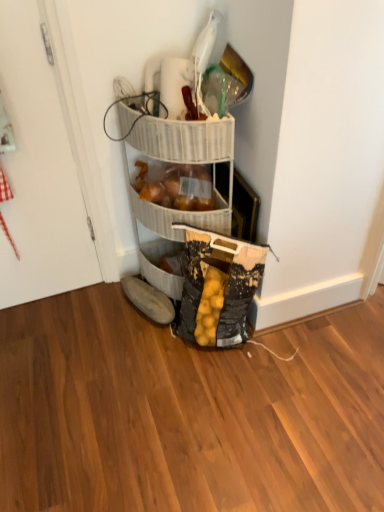
Image resolution: width=384 pixels, height=512 pixels. What are the coordinates of `translucent plastic bag of onions at center` in the screenshot? It's located at (179, 217).

The image size is (384, 512). What do you see at coordinates (179, 217) in the screenshot?
I see `translucent plastic bag of onions at center` at bounding box center [179, 217].

This screenshot has width=384, height=512. Find the location of `white glossy door at left`. white glossy door at left is located at coordinates (38, 172).

You are a GUI agent. You are given a task and a screenshot of the screen. Output one action in this format:
    pyautogui.click(x=<x>, y=<y>)
    Task: Click on the translucent plastic bag of onions at center
    
    Given the screenshot: What is the action you would take?
    tap(179, 217)

Is brown suede shoe at lower center beside translucent plastic bag of onions at center?

No, brown suede shoe at lower center is not in contact with translucent plastic bag of onions at center.

From the image's perspective, which one is positioned higher, brown suede shoe at lower center or translucent plastic bag of onions at center?

translucent plastic bag of onions at center is shown above in the image.

Based on the photo, is brown suede shoe at lower center facing towards translucent plastic bag of onions at center?

No, brown suede shoe at lower center is not oriented towards translucent plastic bag of onions at center.

Who is bigger, white glossy door at left or translucent plastic bag of onions at center?

white glossy door at left is bigger.

Image resolution: width=384 pixels, height=512 pixels. In order to click on door that is above the translucent plastic bag of onions at center (from a real-world perspective) in this screenshot , I will do `click(38, 172)`.

Consider the image. Could you tell me if white glossy door at left is turned towards translucent plastic bag of onions at center?

No, white glossy door at left is not oriented towards translucent plastic bag of onions at center.

How much distance is there between white glossy door at left and translucent plastic bag of onions at center?

white glossy door at left is 15.22 inches from translucent plastic bag of onions at center.

Is brown suede shoe at lower center positioned with its back to white glossy door at left?

No.

Considering the positions of points (159, 291) and (70, 260), is point (159, 291) farther from camera compared to point (70, 260)?

No, (159, 291) is in front of (70, 260).

Would you say brown suede shoe at lower center is to the left or to the right of white glossy door at left in the picture?

Clearly, brown suede shoe at lower center is on the right of white glossy door at left in the image.

Consider the image. How different are the orientations of brown suede shoe at lower center and white glossy door at left in degrees?

73.6 degrees separate the facing orientations of brown suede shoe at lower center and white glossy door at left.

Is translucent plastic bag of onions at center turned away from brown suede shoe at lower center?

translucent plastic bag of onions at center does not have its back to brown suede shoe at lower center.

From the picture: Is translucent plastic bag of onions at center placed right next to brown suede shoe at lower center?

translucent plastic bag of onions at center and brown suede shoe at lower center are not in contact.

From a real-world perspective, is translucent plastic bag of onions at center above or below brown suede shoe at lower center?

From a real-world perspective, translucent plastic bag of onions at center is physically above brown suede shoe at lower center.

Who is shorter, translucent plastic bag of onions at center or white glossy door at left?

translucent plastic bag of onions at center.

Can you confirm if translucent plastic bag of onions at center is bigger than white glossy door at left?

Incorrect, translucent plastic bag of onions at center is not larger than white glossy door at left.

From a real-world perspective, is translucent plastic bag of onions at center on top of white glossy door at left?

No, from a real-world perspective, translucent plastic bag of onions at center is not on top of white glossy door at left.

Could you tell me if translucent plastic bag of onions at center is facing white glossy door at left?

No, translucent plastic bag of onions at center is not aimed at white glossy door at left.

Between point (53, 193) and point (166, 304), which one is positioned behind?

Positioned behind is point (166, 304).

Is white glossy door at left not inside brown suede shoe at lower center?

That's correct, white glossy door at left is outside of brown suede shoe at lower center.

Would you say white glossy door at left is to the left or to the right of brown suede shoe at lower center in the picture?

white glossy door at left is positioned on brown suede shoe at lower center's left side.

Is white glossy door at left looking in the opposite direction of brown suede shoe at lower center?

No, white glossy door at left is not facing the opposite direction of brown suede shoe at lower center.

You are a GUI agent. You are given a task and a screenshot of the screen. Output one action in this format:
    pyautogui.click(x=<x>, y=<y>)
    Task: Click on the basket that is above the brown suede shoe at lower center (from the image's perspective)
    The image size is (384, 512).
    Given the screenshot: What is the action you would take?
    pyautogui.click(x=179, y=217)

Where is `basket on the right of white glossy door at left`? The height and width of the screenshot is (512, 384). basket on the right of white glossy door at left is located at coordinates (179, 217).

Looking at the image, which one is located further to white glossy door at left, translucent plastic bag of onions at center or brown suede shoe at lower center?

Among the two, brown suede shoe at lower center is located further to white glossy door at left.

Looking at this image, looking at the image, which one is located closer to translucent plastic bag of onions at center, white glossy door at left or brown suede shoe at lower center?

Among the two, brown suede shoe at lower center is located nearer to translucent plastic bag of onions at center.

Looking at the image, which one is located closer to brown suede shoe at lower center, white glossy door at left or translucent plastic bag of onions at center?

translucent plastic bag of onions at center is closer to brown suede shoe at lower center.

Based on their spatial positions, is brown suede shoe at lower center or white glossy door at left closer to translucent plastic bag of onions at center?

Based on the image, brown suede shoe at lower center appears to be nearer to translucent plastic bag of onions at center.

Based on their spatial positions, is brown suede shoe at lower center or translucent plastic bag of onions at center further from white glossy door at left?

The object further to white glossy door at left is brown suede shoe at lower center.

Looking at the image, which one is located further to brown suede shoe at lower center, translucent plastic bag of onions at center or white glossy door at left?

white glossy door at left lies further to brown suede shoe at lower center than the other object.

This screenshot has height=512, width=384. In order to click on footwear between white glossy door at left and translucent plastic bag of onions at center from left to right in this screenshot , I will do `click(148, 298)`.